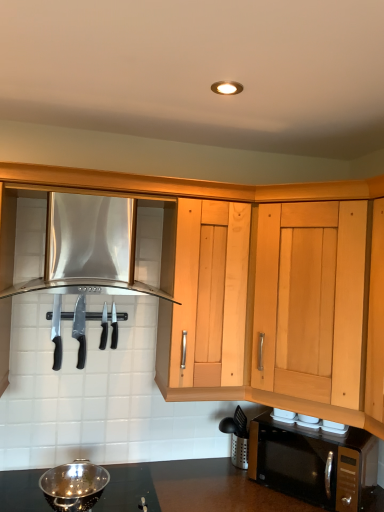
Question: Is black plastic knife at left, which appears as the first knife when viewed from the left, bigger or smaller than polished stainless steel knife at center, the 2th silverware positioned from the left?

Choices:
 (A) big
 (B) small

Answer: (A)

Question: Choose the correct answer: Is black plastic knife at left, which appears as the second knife when viewed from the right, inside polished stainless steel knife at center, the 2th silverware positioned from the left, or outside it?

Choices:
 (A) outside
 (B) inside

Answer: (A)

Question: Which is nearer to the black plastic knife at center, the first silverware viewed from the left?

Choices:
 (A) light wood cabinet at upper right, which ranks as the 2th cabinetry in left-to-right order
 (B) black matte microwave at lower right
 (C) polished stainless steel knife at center, the 2th silverware positioned from the left
 (D) stainless steel range hood at upper left, marked as the first cabinetry in a left-to-right arrangement
 (E) polished stainless steel bowl at lower left

Answer: (C)

Question: Which object is the farthest from the black plastic knife at left, which appears as the second knife when viewed from the right?

Choices:
 (A) polished silver knife at center, the second knife viewed from the left
 (B) black plastic knife at center, the first silverware viewed from the left
 (C) light wood cabinet at upper right, the first cabinetry from the right
 (D) polished stainless steel knife at center, which is counted as the 1th silverware, starting from the right
 (E) stainless steel range hood at upper left, the 2th cabinetry from the right

Answer: (C)